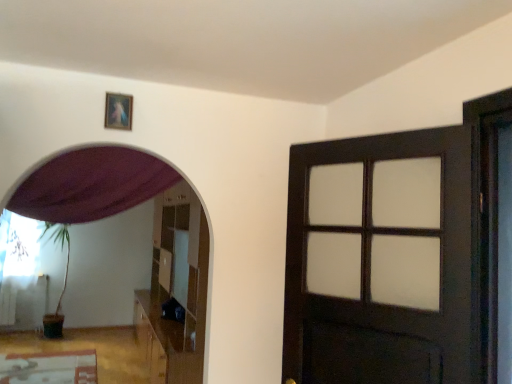
Question: From a real-world perspective, is dark wood door at right located higher than white sheer curtain at left, positioned as the first curtain in back-to-front order?

Choices:
 (A) yes
 (B) no

Answer: (A)

Question: Is white sheer curtain at left, marked as the second curtain in a front-to-back arrangement, completely or partially inside dark wood door at right?

Choices:
 (A) no
 (B) yes

Answer: (A)

Question: Is dark wood door at right positioned with its back to white sheer curtain at left, positioned as the first curtain in back-to-front order?

Choices:
 (A) yes
 (B) no

Answer: (B)

Question: Does dark wood door at right have a larger size compared to white sheer curtain at left, positioned as the first curtain in back-to-front order?

Choices:
 (A) no
 (B) yes

Answer: (B)

Question: Is dark wood door at right wider than white sheer curtain at left, which is counted as the second curtain, starting from the top?

Choices:
 (A) no
 (B) yes

Answer: (B)

Question: Looking at their shapes, would you say purple fabric curtain at upper left, the 1th curtain positioned from the top, is wider or thinner than dark wood door at right?

Choices:
 (A) wide
 (B) thin

Answer: (A)

Question: Based on their positions, is purple fabric curtain at upper left, which ranks as the 1th curtain in right-to-left order, located to the left or right of dark wood door at right?

Choices:
 (A) left
 (B) right

Answer: (A)

Question: Relative to dark wood door at right, is purple fabric curtain at upper left, which is counted as the 2th curtain, starting from the left, in front or behind?

Choices:
 (A) behind
 (B) front

Answer: (A)

Question: Does point tap(117, 172) appear closer or farther from the camera than point tap(396, 221)?

Choices:
 (A) closer
 (B) farther

Answer: (B)

Question: From the image's perspective, is purple fabric curtain at upper left, which is the first curtain in front-to-back order, above or below white sheer curtain at left, which is counted as the second curtain, starting from the right?

Choices:
 (A) above
 (B) below

Answer: (A)

Question: Relative to white sheer curtain at left, marked as the second curtain in a front-to-back arrangement, is purple fabric curtain at upper left, which ranks as the 1th curtain in right-to-left order, in front or behind?

Choices:
 (A) behind
 (B) front

Answer: (B)

Question: Is purple fabric curtain at upper left, which ranks as the 1th curtain in right-to-left order, taller or shorter than white sheer curtain at left, positioned as the first curtain in back-to-front order?

Choices:
 (A) tall
 (B) short

Answer: (B)

Question: Visually, is purple fabric curtain at upper left, the 1th curtain positioned from the top, positioned to the left or to the right of white sheer curtain at left, which is counted as the second curtain, starting from the top?

Choices:
 (A) right
 (B) left

Answer: (A)

Question: Is wooden picture frame at upper center taller or shorter than white sheer curtain at left, which is counted as the second curtain, starting from the right?

Choices:
 (A) tall
 (B) short

Answer: (B)

Question: Is wooden picture frame at upper center in front of or behind white sheer curtain at left, which is counted as the second curtain, starting from the top, in the image?

Choices:
 (A) front
 (B) behind

Answer: (A)